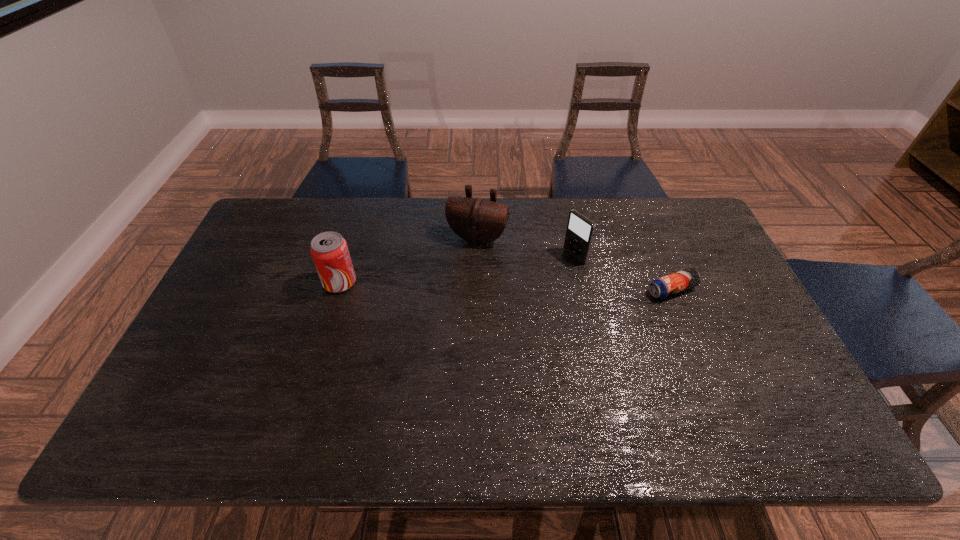
The height and width of the screenshot is (540, 960). I want to click on vacant space that satisfies the following two spatial constraints: 1. on the front side of the second object from left to right; 2. on the right side of the beer can, so click(477, 289).

At what (x,y) coordinates should I click in order to perform the action: click on vacant space that satisfies the following two spatial constraints: 1. on the front side of the second object from right to left; 2. on the left side of the second object from left to right. Please return your answer as a coordinate pair (x, y). The image size is (960, 540). Looking at the image, I should click on pos(477,256).